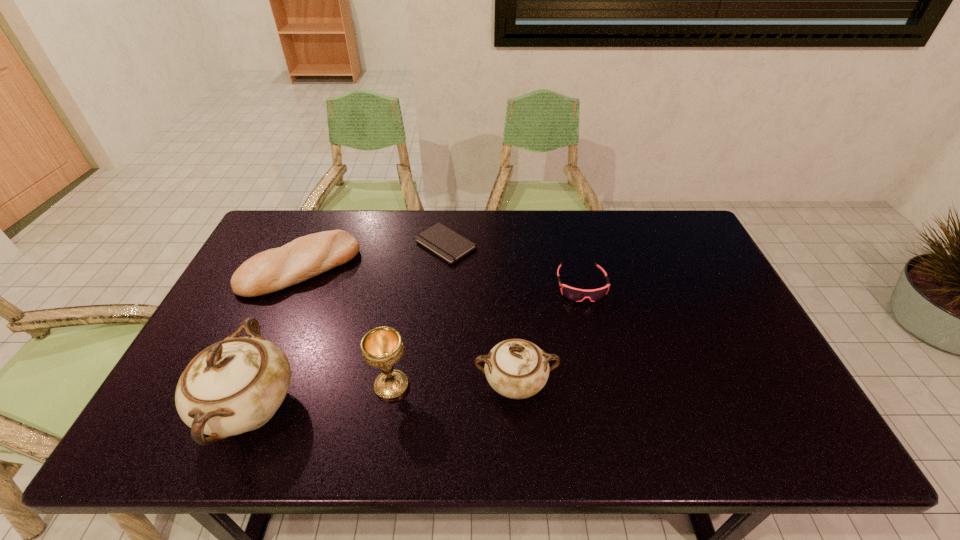
The height and width of the screenshot is (540, 960). I want to click on free spot located on the left of the shortest object, so click(x=322, y=244).

Identify the location of blank area located 0.210m on the right of the fourth tallest object. This screenshot has width=960, height=540. [422, 267].

The height and width of the screenshot is (540, 960). Identify the location of vacant position located 0.340m on the front-facing side of the fifth tallest object. (612, 411).

You are a GUI agent. You are given a task and a screenshot of the screen. Output one action in this format:
    pyautogui.click(x=<x>, y=<y>)
    Task: Click on the free location located 0.050m on the right of the chalice
    This screenshot has height=540, width=960.
    Given the screenshot: What is the action you would take?
    pyautogui.click(x=432, y=386)

This screenshot has height=540, width=960. I want to click on checkbook that is at the far edge, so click(x=447, y=244).

Identify the location of bread positioned at the far edge. The width and height of the screenshot is (960, 540). (275, 269).

Where is `chalice that is at the near edge`? The width and height of the screenshot is (960, 540). chalice that is at the near edge is located at coordinates (381, 347).

This screenshot has height=540, width=960. What are the coordinates of `chinaware that is positioned at the left edge` in the screenshot? It's located at (236, 385).

At what (x,y) coordinates should I click in order to perform the action: click on bread that is at the left edge. Please return your answer as a coordinate pair (x, y). This screenshot has width=960, height=540. Looking at the image, I should click on (275, 269).

Where is `object that is at the far left corner`? The width and height of the screenshot is (960, 540). object that is at the far left corner is located at coordinates (275, 269).